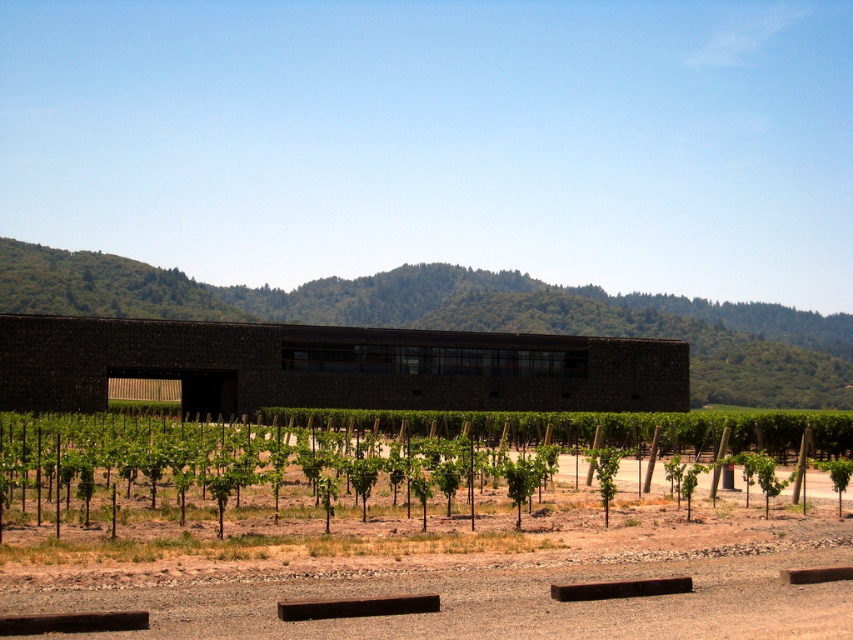
Who is more forward, (138,292) or (608,472)?

Point (608,472) is in front.

Is point (483, 289) farther from camera compared to point (608, 456)?

Yes, it is behind point (608, 456).

Find the location of `dark brown stone building at center`. dark brown stone building at center is located at coordinates (451, 314).

Between point (463, 461) and point (111, 268), which one is positioned behind?

Positioned behind is point (111, 268).

The image size is (853, 640). What are the coordinates of `green leafy vines at lower center` in the screenshot? It's located at (368, 452).

Can you confirm if green leafy vines at lower center is positioned to the left of green leafy tree at center?

Correct, you'll find green leafy vines at lower center to the left of green leafy tree at center.

Who is lower down, green leafy vines at lower center or green leafy tree at center?

green leafy vines at lower center is below.

The height and width of the screenshot is (640, 853). What do you see at coordinates (368, 452) in the screenshot? I see `green leafy vines at lower center` at bounding box center [368, 452].

The image size is (853, 640). I want to click on green leafy vines at lower center, so click(368, 452).